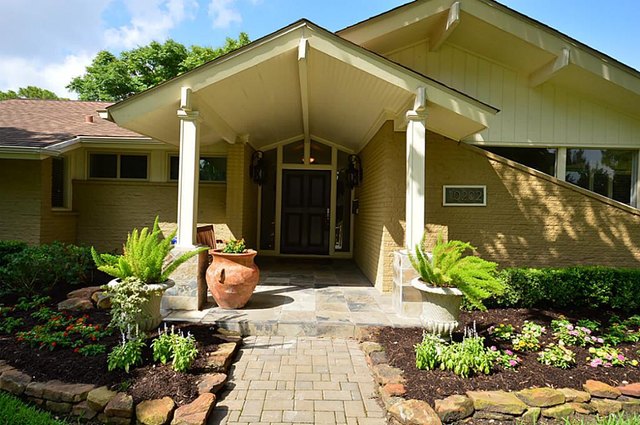
This screenshot has width=640, height=425. I want to click on door, so click(x=312, y=191).